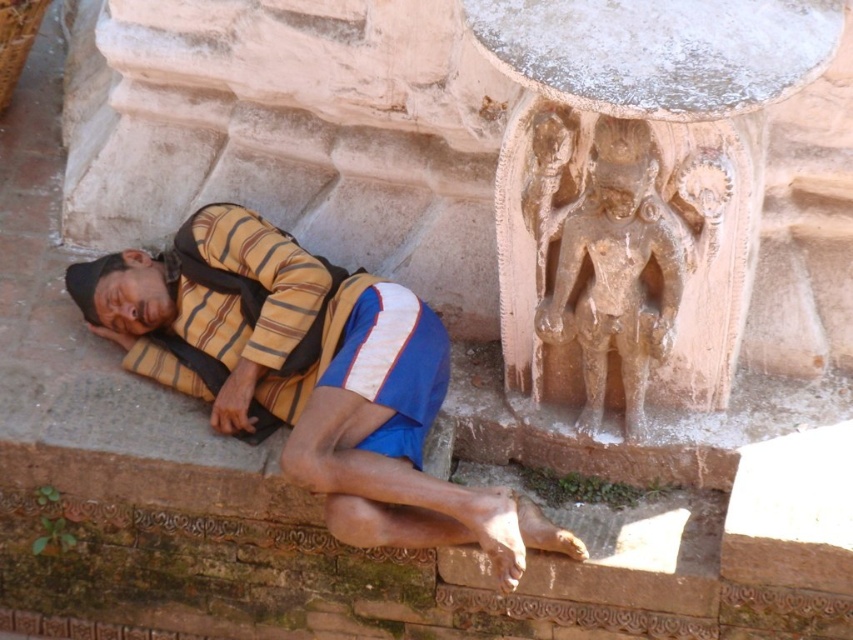
Which is more to the left, yellow striped shirt at left or brown stone carving at upper right?

yellow striped shirt at left

Who is taller, yellow striped shirt at left or brown stone carving at upper right?

yellow striped shirt at left is taller.

Between point (183, 250) and point (601, 161), which one is positioned behind?

The point (183, 250) is behind.

I want to click on yellow striped shirt at left, so click(x=309, y=378).

This screenshot has height=640, width=853. What do you see at coordinates (636, 188) in the screenshot?
I see `carved stone figure at upper center` at bounding box center [636, 188].

Where is `carved stone figure at upper center`? carved stone figure at upper center is located at coordinates (636, 188).

The height and width of the screenshot is (640, 853). I want to click on carved stone figure at upper center, so click(x=636, y=188).

Image resolution: width=853 pixels, height=640 pixels. Find the location of `carved stone figure at upper center`. carved stone figure at upper center is located at coordinates (636, 188).

Between carved stone figure at upper center and yellow striped shirt at left, which one appears on the right side from the viewer's perspective?

carved stone figure at upper center is more to the right.

Which is in front, point (503, 356) or point (283, 269)?

Positioned in front is point (283, 269).

The image size is (853, 640). Find the location of `carved stone figure at upper center`. carved stone figure at upper center is located at coordinates (636, 188).